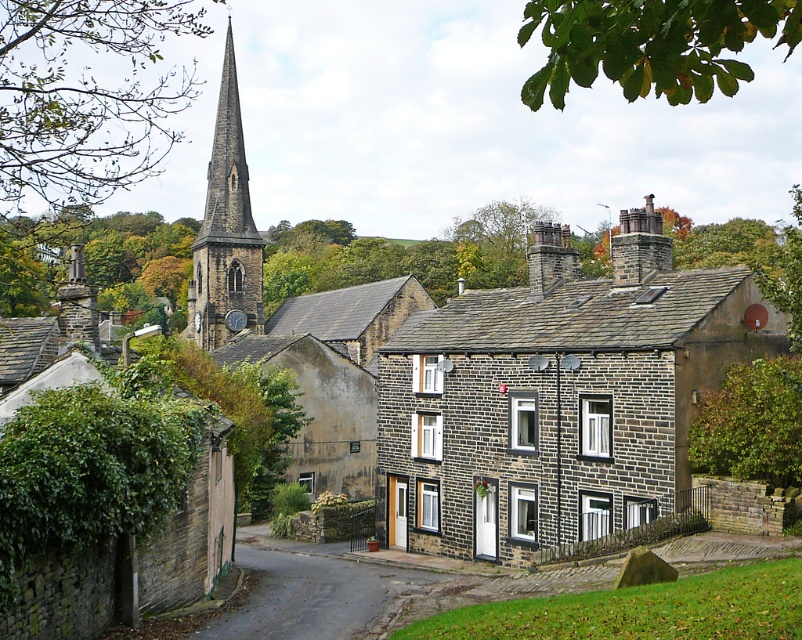
Question: Which is nearer to the dark gray stone chimney at upper right?

Choices:
 (A) stone statue at upper left
 (B) dark gray stone steeple at upper left
 (C) dark gray stone chimney at center

Answer: (C)

Question: Which point appears closest to the camera in this image?

Choices:
 (A) (211, 211)
 (B) (577, 513)
 (C) (71, 282)
 (D) (545, 236)

Answer: (B)

Question: Is brown stone house at center smaller than dark gray stone chimney at upper right?

Choices:
 (A) yes
 (B) no

Answer: (B)

Question: Among these objects, which one is nearest to the camera?

Choices:
 (A) brown stone house at center
 (B) green leafy tree at upper left

Answer: (B)

Question: Is brown stone house at center further to camera compared to stone statue at upper left?

Choices:
 (A) yes
 (B) no

Answer: (B)

Question: Is the position of brown stone house at center less distant than that of green leafy tree at upper left?

Choices:
 (A) no
 (B) yes

Answer: (A)